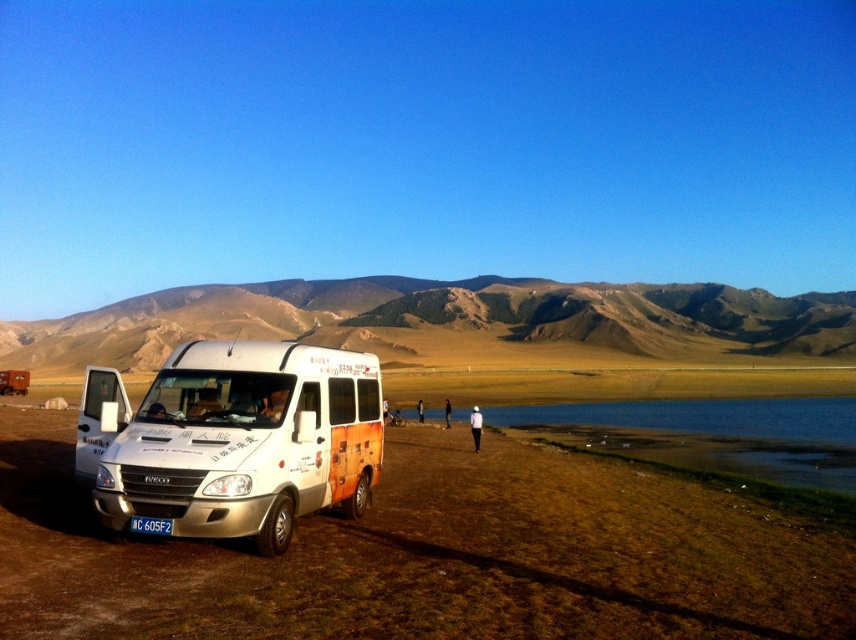
You are a photographer standing at the edge of the grassy plain. You want to take a photo of the white matte van at lower left and the white plastic license plate at lower center. Which object will appear larger in the photo?

The white matte van at lower left is taller than the white plastic license plate at lower center, so it will appear larger in the photo.